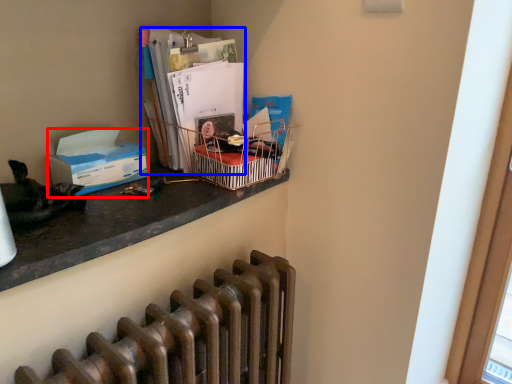
Question: Among these objects, which one is farthest to the camera, box (highlighted by a red box) or magazine (highlighted by a blue box)?

Choices:
 (A) box
 (B) magazine

Answer: (B)